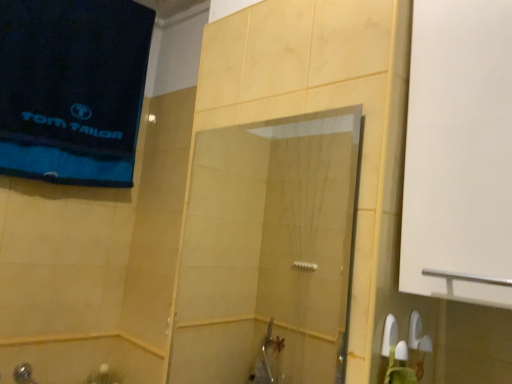
Question: From the image's perspective, is transparent glass shower door at center located above or below shiny metallic showerhead at lower left?

Choices:
 (A) above
 (B) below

Answer: (A)

Question: In terms of width, does transparent glass shower door at center look wider or thinner when compared to shiny metallic showerhead at lower left?

Choices:
 (A) wide
 (B) thin

Answer: (B)

Question: Based on their relative distances, which object is farther from the blue cotton towel at upper left?

Choices:
 (A) shiny metallic showerhead at lower left
 (B) transparent glass shower door at center

Answer: (A)

Question: Which is farther from the transparent glass shower door at center?

Choices:
 (A) blue cotton towel at upper left
 (B) shiny metallic showerhead at lower left

Answer: (B)